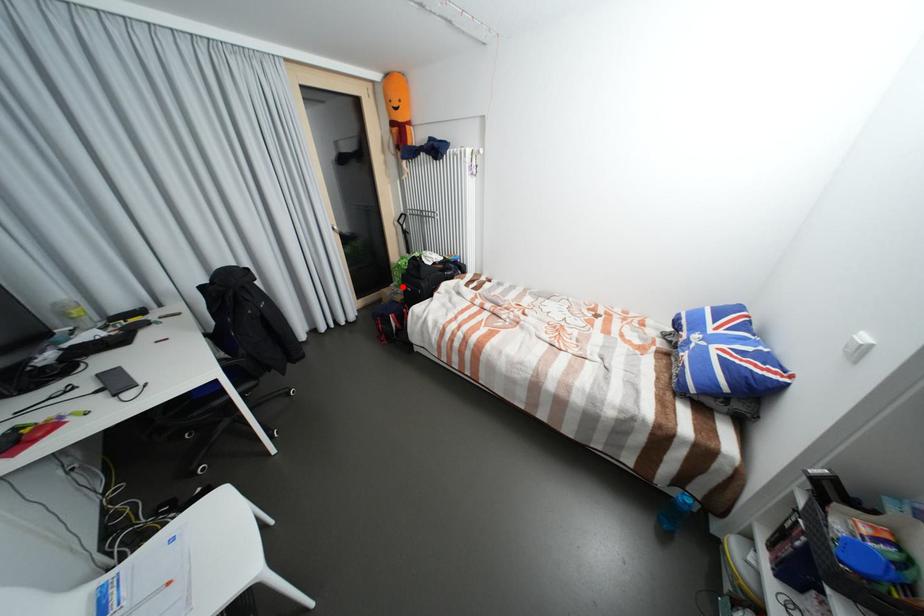
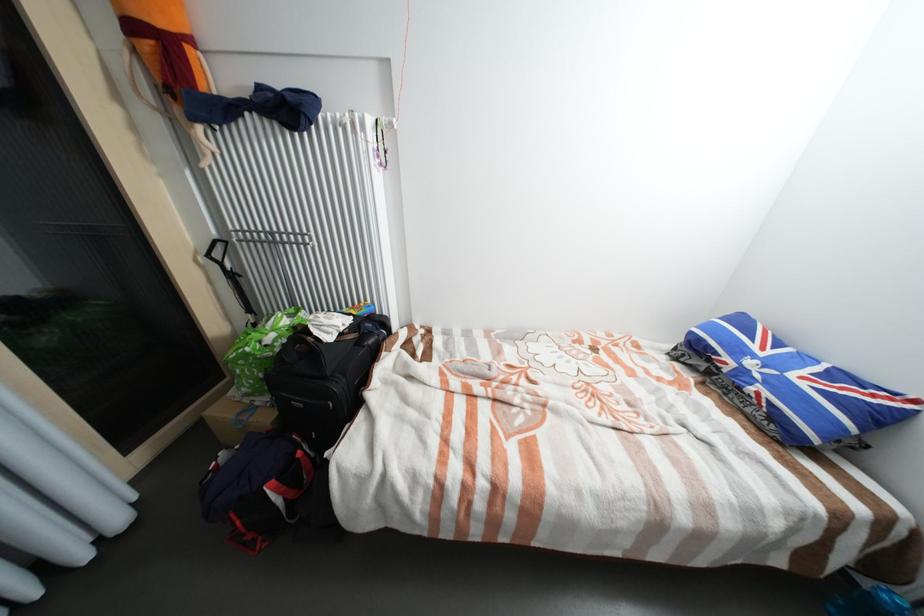
In the second image, find the point that corresponds to the highlighted location in the first image.

(253, 395)